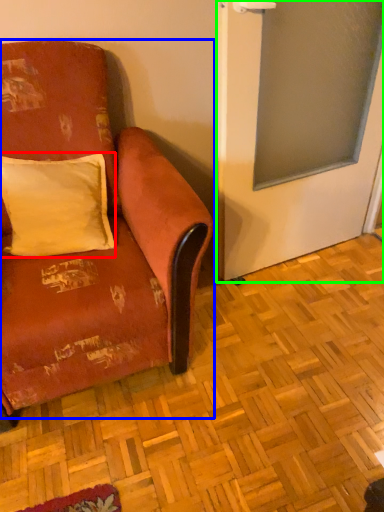
Question: Estimate the real-world distances between objects in this image. Which object is closer to pillow (highlighted by a red box), studio couch (highlighted by a blue box) or screen door (highlighted by a green box)?

Choices:
 (A) studio couch
 (B) screen door

Answer: (A)